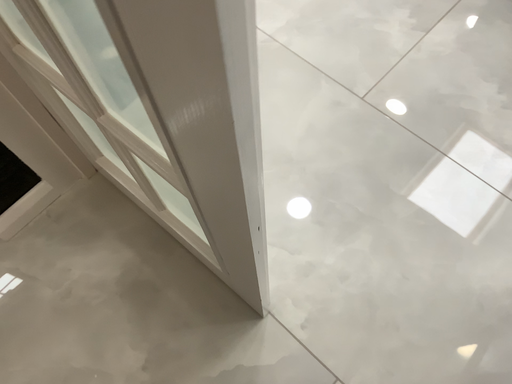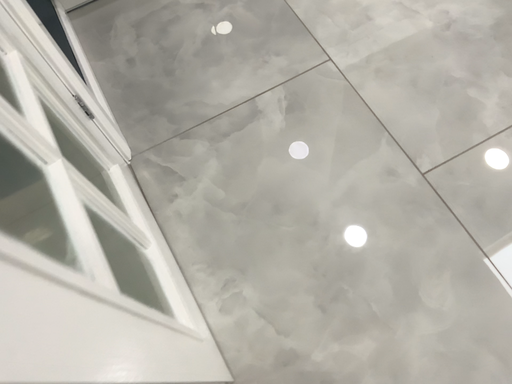
Question: Which way did the camera rotate in the video?

Choices:
 (A) rotated left
 (B) rotated right

Answer: (A)